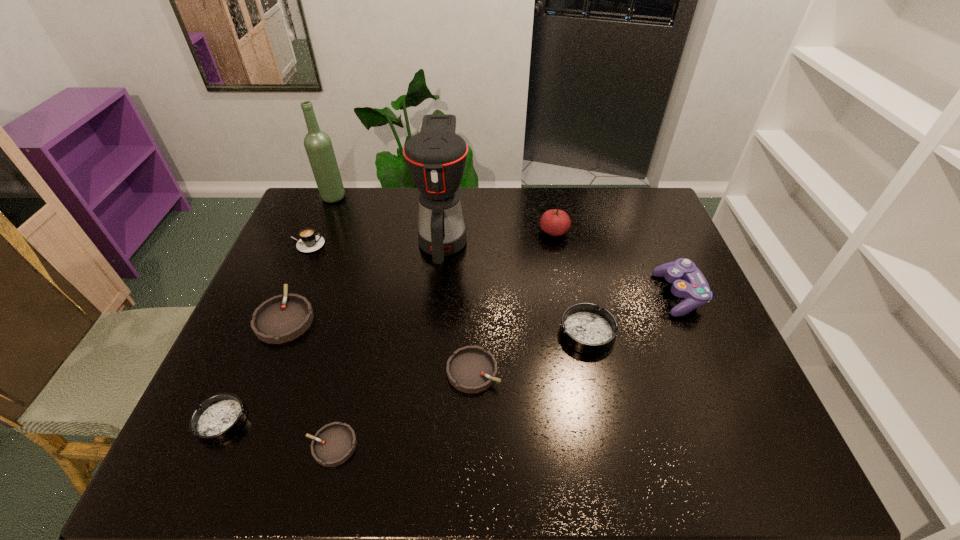
At what (x,y) coordinates should I click in order to perform the action: click on green wine bottle. Please return your answer as a coordinate pair (x, y). This screenshot has width=960, height=540. Looking at the image, I should click on (318, 145).

The image size is (960, 540). Find the location of `the farthest object`. the farthest object is located at coordinates click(x=318, y=145).

Identify the location of coffee maker. (436, 157).

The height and width of the screenshot is (540, 960). Identify the location of red tomato. (555, 222).

Identify the location of control. (688, 281).

Find the location of `the rightmost object`. the rightmost object is located at coordinates (688, 281).

Identify the location of cappuccino. The width and height of the screenshot is (960, 540). (309, 242).

This screenshot has height=540, width=960. I want to click on the farthest gray ashtray, so click(x=282, y=318).

This screenshot has height=540, width=960. I want to click on the biggest gray ashtray, so click(282, 318).

I want to click on the right dark ashtray, so click(586, 328).